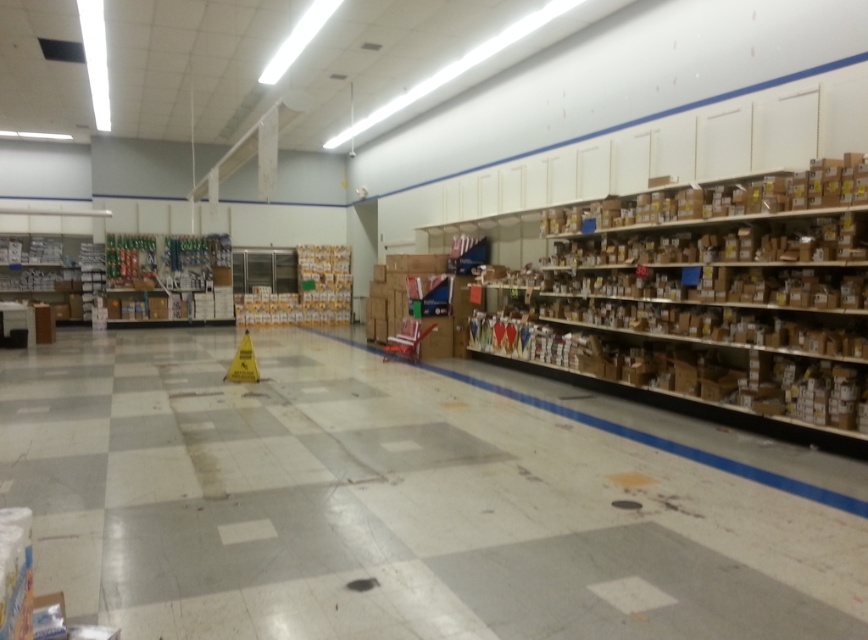
Looking at this image, you are a delivery person who just arrived at the store with a large carton box. You need to place it somewhere. Considering the white glossy floor at center and the brown cardboard shelves at right, which location has more space to accommodate your box?

The white glossy floor at center has a larger size compared to the brown cardboard shelves at right, so it can accommodate the large carton box better.